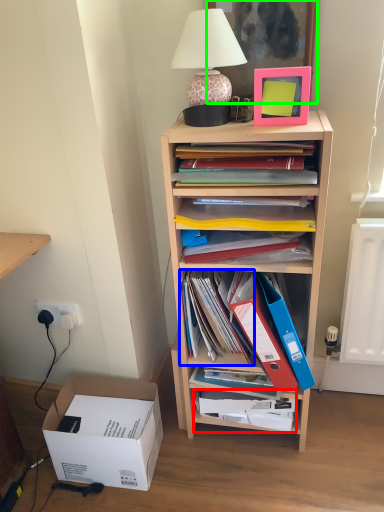
Question: Estimate the real-world distances between objects in this image. Which object is farther from book (highlighted by a red box), book (highlighted by a blue box) or picture frame (highlighted by a green box)?

Choices:
 (A) book
 (B) picture frame

Answer: (B)